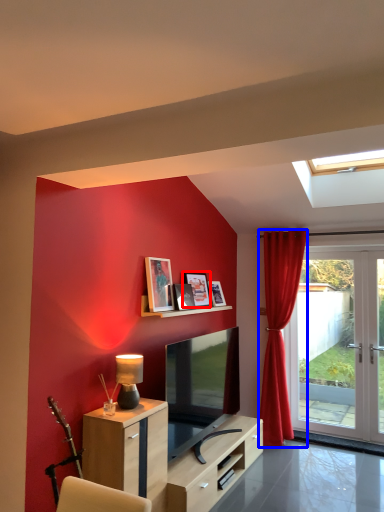
Question: Which point is closer to the camera, picture frame (highlighted by a red box) or curtain (highlighted by a blue box)?

Choices:
 (A) picture frame
 (B) curtain

Answer: (A)